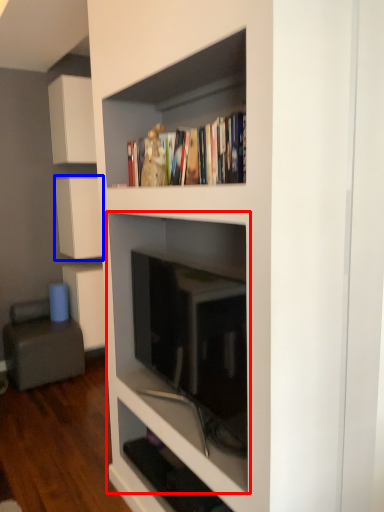
Question: Which point is closer to the camera, shelf (highlighted by a red box) or cabinetry (highlighted by a blue box)?

Choices:
 (A) shelf
 (B) cabinetry

Answer: (A)